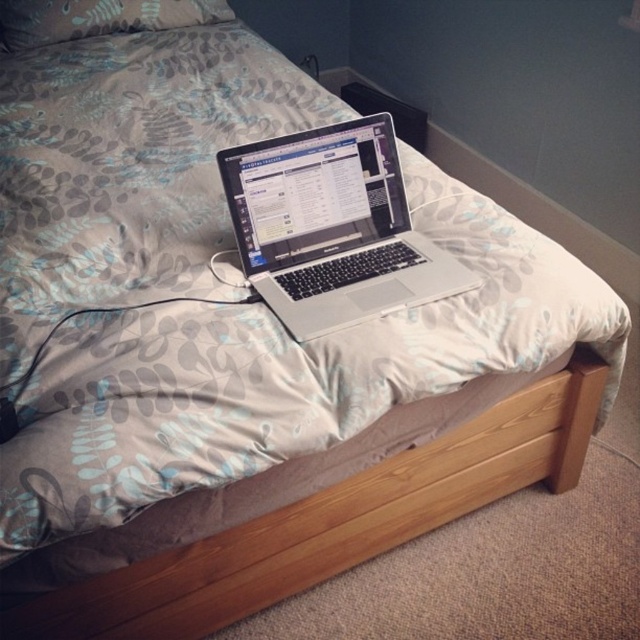
Who is taller, silver metallic laptop at center or gray fabric pillow at upper center?

silver metallic laptop at center

Who is positioned more to the left, silver metallic laptop at center or gray fabric pillow at upper center?

Positioned to the left is gray fabric pillow at upper center.

Who is more distant from viewer, (x=228, y=180) or (x=177, y=13)?

The point (x=177, y=13) is behind.

The width and height of the screenshot is (640, 640). Identify the location of silver metallic laptop at center. (332, 227).

Can you confirm if wooden bed frame at lower center is thinner than gray fabric pillow at upper center?

No.

Is point (593, 397) farther from camera compared to point (65, 32)?

No, (593, 397) is in front of (65, 32).

The width and height of the screenshot is (640, 640). Find the location of `wooden bed frame at lower center`. wooden bed frame at lower center is located at coordinates (332, 522).

Is wooden bed frame at lower center wider than silver metallic laptop at center?

Yes.

Which is in front, point (276, 586) or point (330, 157)?

Point (276, 586)

Locate an element on the screen. wooden bed frame at lower center is located at coordinates coord(332,522).